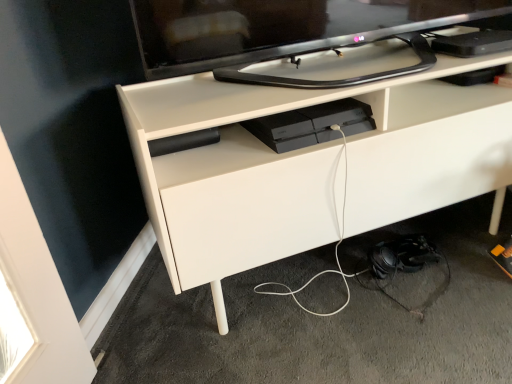
The width and height of the screenshot is (512, 384). What are the coordinates of `free space above white matte desk at center (from a real-world perspective)` in the screenshot? It's located at (300, 66).